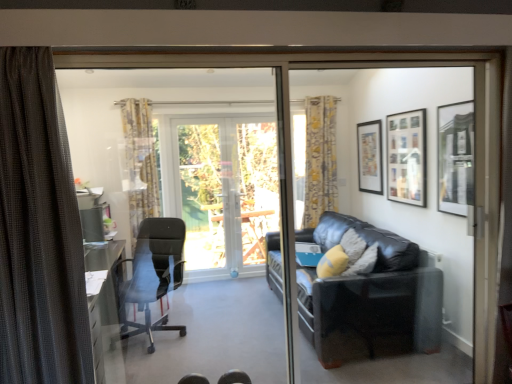
Image resolution: width=512 pixels, height=384 pixels. Describe the element at coordinates (183, 156) in the screenshot. I see `transparent glass screen door at center, which is counted as the second screen door, starting from the right` at that location.

I want to click on yellow floral fabric curtain at upper right, marked as the 3th curtain in a left-to-right arrangement, so click(x=320, y=159).

You are a GUI agent. You are given a task and a screenshot of the screen. Output one action in this format:
    pyautogui.click(x=<x>, y=<y>)
    Task: Click on the yellow floral fabric curtain at left, which appears as the 2th curtain when viewed from the back
    This screenshot has height=384, width=512.
    Given the screenshot: What is the action you would take?
    pyautogui.click(x=140, y=162)

At what (x,y) coordinates should I click in order to perform the action: click on matte black picture frame at upper right, which is the 2th picture frame from back to front. Please return your answer as a coordinate pair (x, y). Image resolution: width=512 pixels, height=384 pixels. Looking at the image, I should click on (406, 157).

Describe the element at coordinates (222, 188) in the screenshot. Image resolution: width=512 pixels, height=384 pixels. I see `transparent glass door at center` at that location.

The width and height of the screenshot is (512, 384). Describe the element at coordinates (386, 167) in the screenshot. I see `black leather couch at right, placed as the second screen door when sorted from left to right` at that location.

The width and height of the screenshot is (512, 384). What are the coordinates of `black textured curtain at left, the 3th curtain in the back-to-front sequence` in the screenshot? It's located at (39, 231).

Identify the location of transparent glass screen door at center, the first screen door in the left-to-right sequence. Image resolution: width=512 pixels, height=384 pixels. (183, 156).

In the scene shown: Is matte black picture frame at upper right, positioned as the 1th picture frame in front-to-back order, facing away from black mesh office chair at left, positioned as the 2th chair in right-to-left order?

No, black mesh office chair at left, positioned as the 2th chair in right-to-left order, is not at the back of matte black picture frame at upper right, positioned as the 1th picture frame in front-to-back order.

Consider the image. Considering the relative sizes of matte black picture frame at upper right, positioned as the 1th picture frame in front-to-back order, and black mesh office chair at left, the 2th chair positioned from the front, in the image provided, is matte black picture frame at upper right, positioned as the 1th picture frame in front-to-back order, smaller than black mesh office chair at left, the 2th chair positioned from the front,?

Yes, matte black picture frame at upper right, positioned as the 1th picture frame in front-to-back order, is smaller than black mesh office chair at left, the 2th chair positioned from the front.

Which point is more forward, (x=466, y=187) or (x=181, y=238)?

The point (x=466, y=187) is closer.

Can transparent glass door at center be found inside matte black office chair at center, which is counted as the 2th chair, starting from the top?

No, transparent glass door at center is not surrounded by matte black office chair at center, which is counted as the 2th chair, starting from the top.

At what (x,y) coordinates should I click in order to perform the action: click on window screen behind the matte black office chair at center, which ranks as the 1th chair in bottom-to-top order. Please return your answer as a coordinate pair (x, y). The width and height of the screenshot is (512, 384). Looking at the image, I should click on coord(202,194).

Is point (221, 376) closer or farther from the camera than point (180, 146)?

Point (221, 376) is closer to the camera than point (180, 146).

Considering their positions, is matte black office chair at center, which is the first chair from front to back, located in front of or behind transparent glass door at center?

Visually, matte black office chair at center, which is the first chair from front to back, is located in front of transparent glass door at center.

From a real-world perspective, is yellow floral fabric curtain at upper right, acting as the 3th curtain starting from the front, on top of matte black picture frame at upper right, which is the 2th picture frame from front to back?

No, from a real-world perspective, yellow floral fabric curtain at upper right, acting as the 3th curtain starting from the front, is not on top of matte black picture frame at upper right, which is the 2th picture frame from front to back.

Which is nearer, (335, 184) or (414, 112)?

The point (414, 112) is closer.

Is yellow floral fabric curtain at upper right, marked as the 3th curtain in a left-to-right arrangement, not inside matte black picture frame at upper right, which is the 2th picture frame from front to back?

Yes.

Is yellow floral fabric curtain at upper right, placed as the first curtain when sorted from right to left, smaller than matte black picture frame at upper right, which is the 2th picture frame from front to back?

Incorrect, yellow floral fabric curtain at upper right, placed as the first curtain when sorted from right to left, is not smaller in size than matte black picture frame at upper right, which is the 2th picture frame from front to back.

From a real-world perspective, which is physically below, matte black picture frame at upper right, acting as the 3th picture frame starting from the front, or transparent glass door at center?

In real-world perspective, transparent glass door at center is lower.

Is the depth of matte black picture frame at upper right, acting as the 3th picture frame starting from the front, less than that of transparent glass door at center?

Yes, matte black picture frame at upper right, acting as the 3th picture frame starting from the front, is closer to the viewer.

You are a GUI agent. You are given a task and a screenshot of the screen. Output one action in this format:
    pyautogui.click(x=<x>, y=<y>)
    Task: Click on the picture frame that is the 1st one when counting rightward from the transparent glass door at center
    Image resolution: width=512 pixels, height=384 pixels.
    Given the screenshot: What is the action you would take?
    pyautogui.click(x=370, y=157)

What's the angular difference between matte black picture frame at upper right, the 1th picture frame when ordered from back to front, and transparent glass door at center's facing directions?

matte black picture frame at upper right, the 1th picture frame when ordered from back to front, and transparent glass door at center are facing 89.6 degrees away from each other.

Would you say matte black office chair at center, the first chair positioned from the right, is to the left or to the right of black leather couch at right, placed as the second screen door when sorted from left to right, in the picture?

matte black office chair at center, the first chair positioned from the right, is to the left of black leather couch at right, placed as the second screen door when sorted from left to right.

From a real-world perspective, is matte black office chair at center, which is counted as the 2th chair, starting from the top, on black leather couch at right, placed as the second screen door when sorted from left to right?

No, from a real-world perspective, matte black office chair at center, which is counted as the 2th chair, starting from the top, is not over black leather couch at right, placed as the second screen door when sorted from left to right

Is matte black office chair at center, acting as the second chair starting from the back, further to the viewer compared to black leather couch at right, which is the first screen door from right to left?

Yes, matte black office chair at center, acting as the second chair starting from the back, is behind black leather couch at right, which is the first screen door from right to left.

Do you think transparent glass screen door at center, the first screen door in the left-to-right sequence, is within transparent glass door at center, or outside of it?

transparent glass screen door at center, the first screen door in the left-to-right sequence, is not inside transparent glass door at center, it's outside.

Is point (128, 243) behind point (241, 261)?

No, it is not.

From a real-world perspective, is transparent glass screen door at center, the first screen door in the left-to-right sequence, located higher than transparent glass door at center?

Yes, from a real-world perspective, transparent glass screen door at center, the first screen door in the left-to-right sequence, is above transparent glass door at center.

Considering their positions, is transparent glass screen door at center, the first screen door in the left-to-right sequence, located in front of or behind transparent glass door at center?

transparent glass screen door at center, the first screen door in the left-to-right sequence, is in front of transparent glass door at center.

Between point (201, 185) and point (420, 187), which one is positioned in front?

The point (420, 187) is in front.

Which is correct: transparent glass screen door at center, the first screen door in the left-to-right sequence, is inside matte black picture frame at upper right, which is the 2th picture frame from back to front, or outside of it?

transparent glass screen door at center, the first screen door in the left-to-right sequence, is not enclosed by matte black picture frame at upper right, which is the 2th picture frame from back to front.

Is transparent glass screen door at center, which is counted as the second screen door, starting from the right, to the left of matte black picture frame at upper right, which is the 2th picture frame from back to front, from the viewer's perspective?

Yes.

Can you tell me how much transparent glass screen door at center, which is counted as the second screen door, starting from the right, and matte black picture frame at upper right, which is the 2th picture frame from back to front, differ in facing direction?

There is a 90-degree angle between the facing directions of transparent glass screen door at center, which is counted as the second screen door, starting from the right, and matte black picture frame at upper right, which is the 2th picture frame from back to front.

From the image's perspective, starting from the matte black picture frame at upper right, positioned as the 1th picture frame in front-to-back order, which chair is the 1st one below? Please provide its 2D coordinates.

[(152, 274)]

Image resolution: width=512 pixels, height=384 pixels. Find the location of `chair on the right of transparent glass door at center`. chair on the right of transparent glass door at center is located at coordinates (234, 377).

Based on their spatial positions, is yellow fabric pillow at right or black leather couch at right, placed as the second screen door when sorted from left to right, further from transparent glass door at center?

yellow fabric pillow at right is further to transparent glass door at center.

Consider the image. Based on their spatial positions, is yellow fabric pillow at right or black mesh office chair at left, placed as the first chair when sorted from top to bottom, closer to transparent glass door at center?

Among the two, black mesh office chair at left, placed as the first chair when sorted from top to bottom, is located nearer to transparent glass door at center.

Which object lies nearer to the anchor point transparent glass door at center, black textured curtain at left, acting as the second curtain starting from the left, or matte black office chair at center, which ranks as the 1th chair in bottom-to-top order?

matte black office chair at center, which ranks as the 1th chair in bottom-to-top order, lies closer to transparent glass door at center than the other object.

When comparing their distances from black textured curtain at left, positioned as the 2th curtain in right-to-left order, does transparent glass door at center or transparent glass door at center seem further?

transparent glass door at center lies further to black textured curtain at left, positioned as the 2th curtain in right-to-left order, than the other object.

Considering their positions, is yellow floral fabric curtain at upper right, marked as the 3th curtain in a left-to-right arrangement, positioned further to matte black picture frame at upper right, positioned as the 1th picture frame in front-to-back order, than transparent glass screen door at center, the first screen door in the left-to-right sequence?

transparent glass screen door at center, the first screen door in the left-to-right sequence, lies further to matte black picture frame at upper right, positioned as the 1th picture frame in front-to-back order, than the other object.

Estimate the real-world distances between objects in this image. Which object is closer to transparent glass screen door at center, the first screen door in the left-to-right sequence, yellow fabric pillow at right or black textured curtain at left, positioned as the 2th curtain in right-to-left order?

yellow fabric pillow at right.

Estimate the real-world distances between objects in this image. Which object is further from yellow floral fabric curtain at left, which appears as the 2th curtain when viewed from the back, transparent glass door at center or transparent glass door at center?

Based on the image, transparent glass door at center appears to be further to yellow floral fabric curtain at left, which appears as the 2th curtain when viewed from the back.

When comparing their distances from matte black picture frame at upper right, positioned as the 1th picture frame in front-to-back order, does transparent glass screen door at center, the first screen door in the left-to-right sequence, or transparent glass door at center seem closer?

Based on the image, transparent glass screen door at center, the first screen door in the left-to-right sequence, appears to be nearer to matte black picture frame at upper right, positioned as the 1th picture frame in front-to-back order.

Locate an element on the screen. chair located between black leather couch at right and yellow floral fabric curtain at upper right, the first curtain from the back, in the depth direction is located at coordinates (152, 274).

Identify the location of pillow between black leather couch at right and matte black picture frame at upper right, the 1th picture frame when ordered from back to front, along the z-axis. (332, 262).

This screenshot has height=384, width=512. I want to click on studio couch positioned between black textured curtain at left, the 3th curtain in the back-to-front sequence, and yellow floral fabric curtain at left, marked as the 2th curtain in a front-to-back arrangement, from near to far, so click(x=369, y=297).

Find the location of `chair situated between transparent glass screen door at center, which is counted as the second screen door, starting from the right, and black leather couch at right from left to right`. chair situated between transparent glass screen door at center, which is counted as the second screen door, starting from the right, and black leather couch at right from left to right is located at coordinates (234, 377).